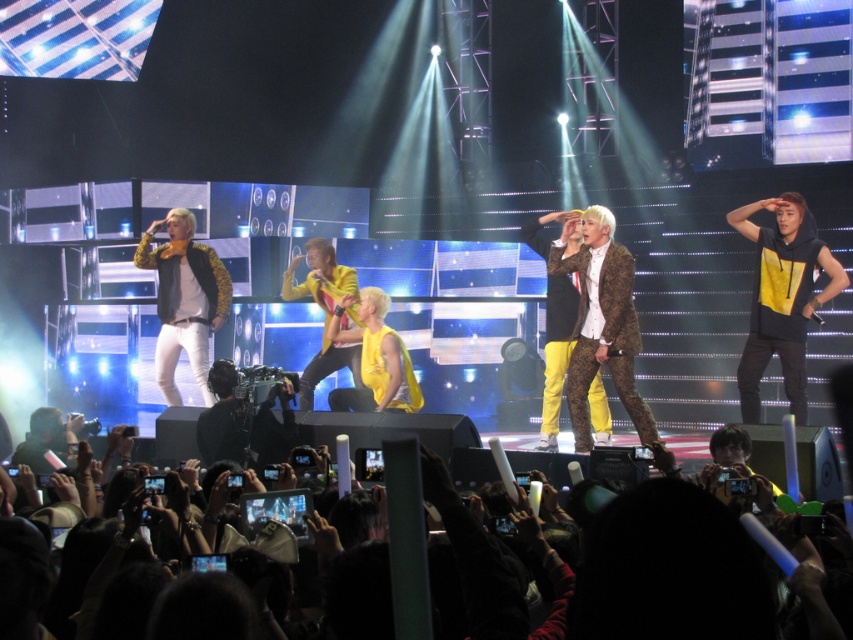
You are a photographer at the concert and want to capture a clear shot of the yellow matte hoodie at right without the black fabric crowd at lower center blocking the view. Based on their heights, can you position yourself so the crowd doesn

The yellow matte hoodie at right is taller than the black fabric crowd at lower center. Positioning yourself at a lower angle would allow the yellow matte hoodie at right to be visible above the crowd.

You are a photographer at the concert. You want to capture a photo of the yellow matte hoodie at right without the black fabric crowd at lower center blocking it. Is this possible given their positions?

The yellow matte hoodie at right is positioned over the black fabric crowd at lower center, so it is possible to capture the yellow matte hoodie at right without obstruction by adjusting the camera angle to focus on its elevated position.

You are standing at the center of the stage. There is a point marked at coordinates point (782, 298). What object is located at this point?

The point (782, 298) marks the yellow matte hoodie at right.